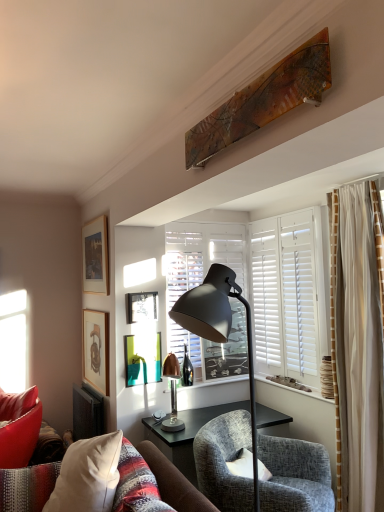
Question: From the image's perspective, would you say wooden picture frame at upper left, placed as the fourth picture frame when sorted from bottom to top, is shown under matte black lamp at center, arranged as the 2th lamp when viewed from the back?

Choices:
 (A) no
 (B) yes

Answer: (A)

Question: Does wooden picture frame at upper left, acting as the first picture frame starting from the top, lie behind matte black lamp at center, arranged as the 2th lamp when viewed from the back?

Choices:
 (A) no
 (B) yes

Answer: (B)

Question: Considering the relative sizes of wooden picture frame at upper left, placed as the fourth picture frame when sorted from bottom to top, and matte black lamp at center, arranged as the 2th lamp when viewed from the back, in the image provided, is wooden picture frame at upper left, placed as the fourth picture frame when sorted from bottom to top, shorter than matte black lamp at center, arranged as the 2th lamp when viewed from the back,?

Choices:
 (A) yes
 (B) no

Answer: (A)

Question: Considering the relative sizes of wooden picture frame at upper left, acting as the first picture frame starting from the top, and matte black lamp at center, the 1th lamp when ordered from front to back, in the image provided, is wooden picture frame at upper left, acting as the first picture frame starting from the top, bigger than matte black lamp at center, the 1th lamp when ordered from front to back,?

Choices:
 (A) no
 (B) yes

Answer: (A)

Question: Would you consider wooden picture frame at upper left, placed as the fourth picture frame when sorted from bottom to top, to be distant from matte black lamp at center, arranged as the 2th lamp when viewed from the back?

Choices:
 (A) yes
 (B) no

Answer: (A)

Question: From a real-world perspective, is white matte window at center above or below velvet white pillow at lower left?

Choices:
 (A) above
 (B) below

Answer: (A)

Question: From their relative heights in the image, would you say white matte window at center is taller or shorter than velvet white pillow at lower left?

Choices:
 (A) tall
 (B) short

Answer: (A)

Question: Relative to velvet white pillow at lower left, is white matte window at center in front or behind?

Choices:
 (A) behind
 (B) front

Answer: (A)

Question: Considering the positions of white matte window at center and velvet white pillow at lower left in the image, is white matte window at center bigger or smaller than velvet white pillow at lower left?

Choices:
 (A) small
 (B) big

Answer: (A)

Question: From a real-world perspective, is wooden matte picture frame at upper left, positioned as the fourth picture frame in top-to-bottom order, positioned above or below wooden picture frame at upper left, placed as the fourth picture frame when sorted from bottom to top?

Choices:
 (A) above
 (B) below

Answer: (B)

Question: Is point (102, 344) closer or farther from the camera than point (102, 263)?

Choices:
 (A) farther
 (B) closer

Answer: (B)

Question: Considering the relative positions of wooden matte picture frame at upper left, positioned as the fourth picture frame in top-to-bottom order, and wooden picture frame at upper left, acting as the first picture frame starting from the top, in the image provided, is wooden matte picture frame at upper left, positioned as the fourth picture frame in top-to-bottom order, to the left or to the right of wooden picture frame at upper left, acting as the first picture frame starting from the top,?

Choices:
 (A) left
 (B) right

Answer: (B)

Question: From the image's perspective, is wooden matte picture frame at upper left, the 1th picture frame ordered from the bottom, located above or below wooden picture frame at upper left, placed as the fourth picture frame when sorted from bottom to top?

Choices:
 (A) below
 (B) above

Answer: (A)

Question: From a real-world perspective, is velvet white pillow at lower left physically located above or below teal glossy picture frame at center, the third picture frame when ordered from top to bottom?

Choices:
 (A) below
 (B) above

Answer: (A)

Question: In terms of height, does velvet white pillow at lower left look taller or shorter compared to teal glossy picture frame at center, the third picture frame when ordered from top to bottom?

Choices:
 (A) tall
 (B) short

Answer: (A)